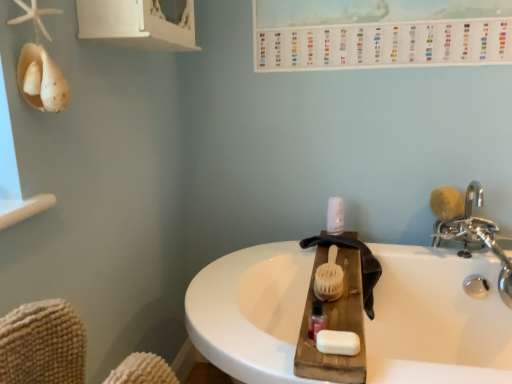
The image size is (512, 384). In order to click on white plastic pump at center in this screenshot , I will do `click(335, 216)`.

At what (x,y) coordinates should I click in order to perform the action: click on pink glossy bottle at center. Please return your answer as a coordinate pair (x, y). Looking at the image, I should click on (316, 320).

Looking at this image, measure the distance between point [481,191] and camera.

They are 4.96 feet apart.

What do you see at coordinates (476, 238) in the screenshot? Image resolution: width=512 pixels, height=384 pixels. I see `silver metallic faucet at upper right` at bounding box center [476, 238].

Locate an element on the screen. white plastic pump at center is located at coordinates (335, 216).

Is white bristle brush at center, the 2th brush when ordered from back to front, facing away from white matte soap at center?

No.

Is white bristle brush at center, placed as the 1th brush when sorted from front to back, to the left of white matte soap at center from the viewer's perspective?

No.

How many degrees apart are the facing directions of white bristle brush at center, positioned as the 2th brush in right-to-left order, and white matte soap at center?

0.00273 degrees.

Which object is wider, silver metallic faucet at upper right or white bristle brush at center, the 1th brush when ordered from bottom to top?

Wider between the two is white bristle brush at center, the 1th brush when ordered from bottom to top.

Does silver metallic faucet at upper right contain white bristle brush at center, which is counted as the first brush, starting from the left?

No, white bristle brush at center, which is counted as the first brush, starting from the left, is not a part of silver metallic faucet at upper right.

Is silver metallic faucet at upper right looking in the opposite direction of white bristle brush at center, the 2th brush when ordered from back to front?

silver metallic faucet at upper right is not turned away from white bristle brush at center, the 2th brush when ordered from back to front.

Does point (480, 227) come behind point (330, 348)?

That is True.

Is the depth of silver metallic faucet at upper right less than that of white matte soap at center?

No, silver metallic faucet at upper right is further to the viewer.

From the image's perspective, is silver metallic faucet at upper right on white matte soap at center?

Yes, from the image's perspective, silver metallic faucet at upper right is on top of white matte soap at center.

Are silver metallic faucet at upper right and white matte soap at center making contact?

No, silver metallic faucet at upper right is not in contact with white matte soap at center.

Is yellow sponge at right, placed as the 1th brush when sorted from right to left, next to white bristle brush at center, the 1th brush when ordered from bottom to top, and touching it?

No.

Could you tell me if yellow sponge at right, acting as the second brush starting from the bottom, is facing white bristle brush at center, the 2th brush when ordered from back to front?

No, yellow sponge at right, acting as the second brush starting from the bottom, does not turn towards white bristle brush at center, the 2th brush when ordered from back to front.

Which of these two, yellow sponge at right, acting as the second brush starting from the bottom, or white bristle brush at center, which is counted as the first brush, starting from the left, is smaller?

yellow sponge at right, acting as the second brush starting from the bottom.

Between white bristle brush at center, which is the second brush from top to bottom, and silver metallic faucet at upper right, which one has less height?

Standing shorter between the two is white bristle brush at center, which is the second brush from top to bottom.

Is white bristle brush at center, the 1th brush when ordered from bottom to top, facing towards silver metallic faucet at upper right?

No, white bristle brush at center, the 1th brush when ordered from bottom to top, does not turn towards silver metallic faucet at upper right.

Is point (338, 266) positioned after point (486, 287)?

No.

From the image's perspective, which one is positioned lower, white bristle brush at center, the 1th brush when ordered from bottom to top, or silver metallic faucet at upper right?

white bristle brush at center, the 1th brush when ordered from bottom to top.

I want to click on toiletry that appears on the right of pink glossy bottle at center, so click(335, 216).

Which of these two, pink glossy bottle at center or white plastic pump at center, is thinner?

With smaller width is pink glossy bottle at center.

Is pink glossy bottle at center aimed at white plastic pump at center?

No, pink glossy bottle at center does not turn towards white plastic pump at center.

In the scene shown: How different are the orientations of pink glossy bottle at center and white plastic pump at center in degrees?

The angle between the facing direction of pink glossy bottle at center and the facing direction of white plastic pump at center is 0.00222 degrees.

What are the coordinates of `the 2nd brush located above the white matte soap at center (from a real-world perspective)` in the screenshot? It's located at (447, 203).

Can you confirm if white matte soap at center is taller than yellow sponge at right, acting as the second brush starting from the bottom?

Incorrect, the height of white matte soap at center is not larger of that of yellow sponge at right, acting as the second brush starting from the bottom.

Does white matte soap at center come behind yellow sponge at right, the first brush from the back?

No, it is not.

Could you tell me if white matte soap at center is turned towards yellow sponge at right, the 2th brush viewed from the left?

No, white matte soap at center is not turned towards yellow sponge at right, the 2th brush viewed from the left.

In order to click on brush that is the 1st object located behind the white matte soap at center in this screenshot , I will do `click(329, 278)`.

What are the coordinates of `tap that appears below the white bristle brush at center, the 1th brush when ordered from bottom to top (from a real-world perspective)` in the screenshot? It's located at 476,238.

Which object lies nearer to the anchor point yellow sponge at right, which is the 1th brush from top to bottom, white bristle brush at center, which is counted as the first brush, starting from the left, or silver metallic faucet at upper right?

silver metallic faucet at upper right is closer to yellow sponge at right, which is the 1th brush from top to bottom.

Looking at the image, which one is located further to silver metallic faucet at upper right, pink glossy bottle at center or yellow sponge at right, which is the 1th brush from top to bottom?

The object further to silver metallic faucet at upper right is pink glossy bottle at center.

Based on their spatial positions, is white plastic pump at center or pink glossy bottle at center further from silver metallic faucet at upper right?

pink glossy bottle at center is further to silver metallic faucet at upper right.

Looking at the image, which one is located closer to white matte soap at center, white bristle brush at center, positioned as the 2th brush in right-to-left order, or silver metallic faucet at upper right?

white bristle brush at center, positioned as the 2th brush in right-to-left order, is closer to white matte soap at center.

Estimate the real-world distances between objects in this image. Which object is closer to silver metallic faucet at upper right, white bristle brush at center, positioned as the 2th brush in right-to-left order, or white plastic pump at center?

white plastic pump at center is closer to silver metallic faucet at upper right.

Considering their positions, is silver metallic faucet at upper right positioned further to white matte soap at center than white bristle brush at center, the 2th brush when ordered from back to front?

silver metallic faucet at upper right lies further to white matte soap at center than the other object.

When comparing their distances from white bristle brush at center, which is counted as the first brush, starting from the left, does silver metallic faucet at upper right or white matte soap at center seem closer?

The object closer to white bristle brush at center, which is counted as the first brush, starting from the left, is white matte soap at center.

From the image, which object appears to be nearer to white matte soap at center, white plastic pump at center or pink glossy bottle at center?

pink glossy bottle at center.

Locate an element on the screen. The height and width of the screenshot is (384, 512). toiletry between pink glossy bottle at center and silver metallic faucet at upper right from left to right is located at coordinates (335, 216).

The width and height of the screenshot is (512, 384). In order to click on soap between pink glossy bottle at center and silver metallic faucet at upper right in this screenshot , I will do `click(338, 342)`.

I want to click on toiletry situated between white bristle brush at center, placed as the 1th brush when sorted from front to back, and yellow sponge at right, acting as the second brush starting from the bottom, from left to right, so click(335, 216).

The height and width of the screenshot is (384, 512). Find the location of `brush between pink glossy bottle at center and yellow sponge at right, which appears as the second brush when viewed from the front, in the horizontal direction`. brush between pink glossy bottle at center and yellow sponge at right, which appears as the second brush when viewed from the front, in the horizontal direction is located at coordinates (329, 278).